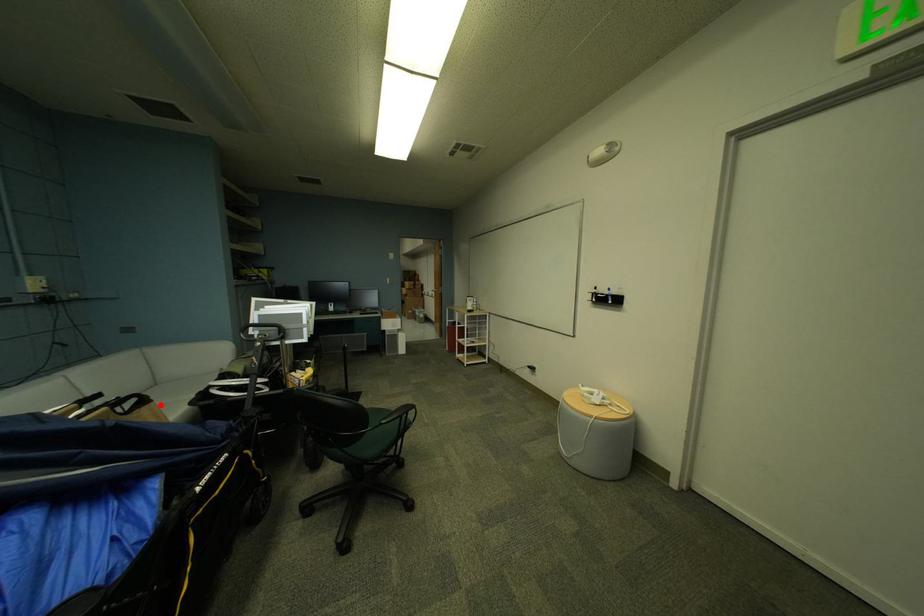
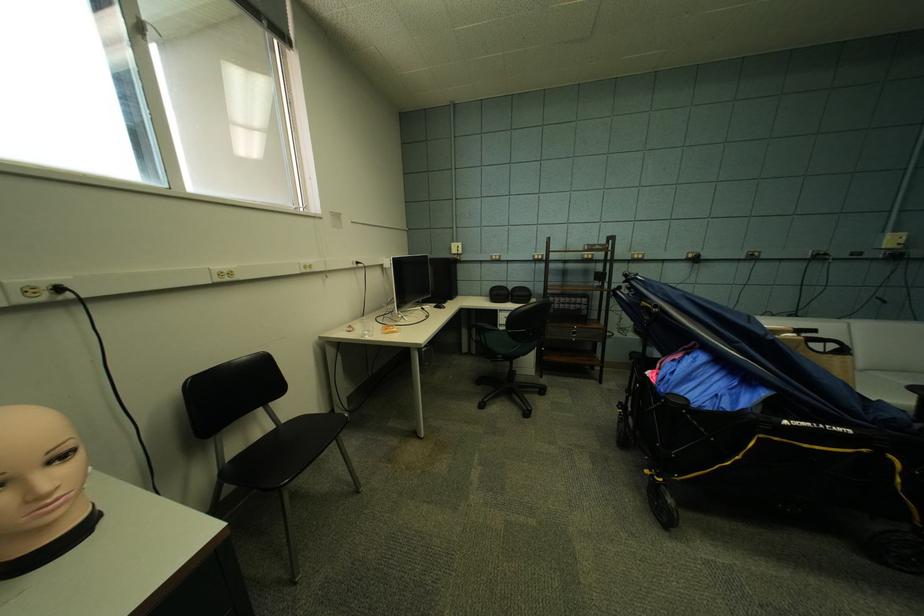
In the second image, find the point that corresponds to the highlighted location in the first image.

(857, 358)